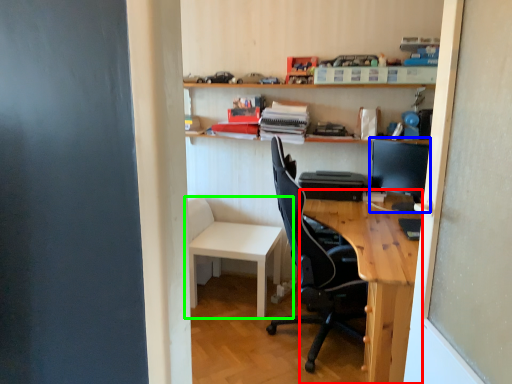
Question: Estimate the real-world distances between objects in this image. Which object is closer to desk (highlighted by a red box), computer monitor (highlighted by a blue box) or table (highlighted by a green box)?

Choices:
 (A) computer monitor
 (B) table

Answer: (A)